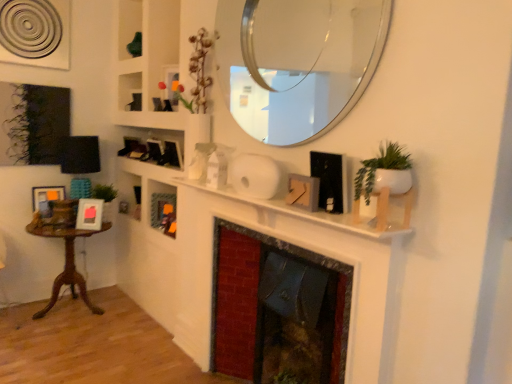
This screenshot has width=512, height=384. Describe the element at coordinates (384, 172) in the screenshot. I see `white matte plant pot at upper right` at that location.

Measure the distance between wooden frame at center and camera.

wooden frame at center and camera are 9.61 feet apart from each other.

This screenshot has width=512, height=384. What are the coordinates of `white matte fireplace at center` in the screenshot? It's located at (328, 213).

The image size is (512, 384). What do you see at coordinates (293, 254) in the screenshot?
I see `marble fireplace at center` at bounding box center [293, 254].

The height and width of the screenshot is (384, 512). Describe the element at coordinates (66, 262) in the screenshot. I see `wooden table at left` at that location.

Locate an element on the screen. The height and width of the screenshot is (384, 512). clear glass mirror at upper center is located at coordinates [x=306, y=64].

Who is bigger, matte white picture frame at left, the second picture frame when ordered from right to left, or matte gray picture frame at center, which is the 1th picture frame from right to left?

Bigger between the two is matte white picture frame at left, the second picture frame when ordered from right to left.

Considering the sizes of objects matte white picture frame at left, which is the second picture frame from back to front, and matte gray picture frame at center, which appears as the third picture frame when viewed from the left, in the image provided, who is shorter, matte white picture frame at left, which is the second picture frame from back to front, or matte gray picture frame at center, which appears as the third picture frame when viewed from the left,?

matte gray picture frame at center, which appears as the third picture frame when viewed from the left.

Is matte white picture frame at left, which is the second picture frame from back to front, aimed at matte gray picture frame at center, which is the 1th picture frame from right to left?

No, matte white picture frame at left, which is the second picture frame from back to front, is not facing towards matte gray picture frame at center, which is the 1th picture frame from right to left.

Based on the photo, can you confirm if white matte plant pot at upper right is bigger than matte wooden picture frame at left, which appears as the first picture frame when viewed from the back?

Correct, white matte plant pot at upper right is larger in size than matte wooden picture frame at left, which appears as the first picture frame when viewed from the back.

Based on the photo, is white matte plant pot at upper right aimed at matte wooden picture frame at left, which appears as the first picture frame when viewed from the back?

No, white matte plant pot at upper right is not turned towards matte wooden picture frame at left, which appears as the first picture frame when viewed from the back.

Who is shorter, white matte plant pot at upper right or matte wooden picture frame at left, marked as the 3th picture frame in a right-to-left arrangement?

matte wooden picture frame at left, marked as the 3th picture frame in a right-to-left arrangement, is shorter.

Is matte wooden picture frame at left, acting as the first picture frame starting from the left, located within white matte plant pot at upper right?

Definitely not — matte wooden picture frame at left, acting as the first picture frame starting from the left, is not inside white matte plant pot at upper right.

Is matte gray picture frame at center, the 3th picture frame positioned from the back, positioned in front of wooden table at left?

Yes.

Is matte gray picture frame at center, the 3th picture frame positioned from the back, situated inside wooden table at left or outside?

matte gray picture frame at center, the 3th picture frame positioned from the back, is not inside wooden table at left, it's outside.

Which point is more forward, (315, 177) or (76, 293)?

The point (315, 177) is closer.

Considering the relative positions of white matte plant pot at upper right and matte gray picture frame at center, the 3th picture frame positioned from the back, in the image provided, is white matte plant pot at upper right to the left of matte gray picture frame at center, the 3th picture frame positioned from the back, from the viewer's perspective?

Incorrect, white matte plant pot at upper right is not on the left side of matte gray picture frame at center, the 3th picture frame positioned from the back.

From the image's perspective, would you say white matte plant pot at upper right is positioned over matte gray picture frame at center, the 1th picture frame viewed from the front?

Correct, white matte plant pot at upper right appears higher than matte gray picture frame at center, the 1th picture frame viewed from the front, in the image.

Does white matte plant pot at upper right have a greater height compared to matte gray picture frame at center, which appears as the third picture frame when viewed from the left?

Yes.

From a real-world perspective, between white matte plant pot at upper right and matte gray picture frame at center, the 3th picture frame positioned from the back, who is vertically lower?

From a 3D spatial view, matte gray picture frame at center, the 3th picture frame positioned from the back, is below.

Does wooden table at left have a greater height compared to matte wooden picture frame at left, marked as the 3th picture frame in a right-to-left arrangement?

Yes, wooden table at left is taller than matte wooden picture frame at left, marked as the 3th picture frame in a right-to-left arrangement.

From a real-world perspective, does wooden table at left sit lower than matte wooden picture frame at left, acting as the first picture frame starting from the left?

Indeed, from a real-world perspective, wooden table at left is positioned beneath matte wooden picture frame at left, acting as the first picture frame starting from the left.

Between point (70, 262) and point (41, 197), which one is positioned behind?

The point (70, 262) is farther.

Looking at their sizes, would you say marble fireplace at center is wider or thinner than wooden frame at center?

In the image, marble fireplace at center appears to be wider than wooden frame at center.

Is marble fireplace at center inside or outside of wooden frame at center?

marble fireplace at center is not enclosed by wooden frame at center.

From a real-world perspective, is marble fireplace at center on wooden frame at center?

Incorrect, from a real-world perspective, marble fireplace at center is lower than wooden frame at center.

From the picture: Are marble fireplace at center and wooden frame at center far apart?

No.

Can we say clear glass mirror at upper center lies outside matte white picture frame at left, which is the second picture frame from back to front?

Yes.

Is clear glass mirror at upper center at the left side of matte white picture frame at left, arranged as the second picture frame when viewed from the front?

In fact, clear glass mirror at upper center is to the right of matte white picture frame at left, arranged as the second picture frame when viewed from the front.

Is clear glass mirror at upper center shorter than matte white picture frame at left, arranged as the second picture frame when viewed from the front?

Incorrect, the height of clear glass mirror at upper center does not fall short of that of matte white picture frame at left, arranged as the second picture frame when viewed from the front.

Considering the sizes of objects clear glass mirror at upper center and matte white picture frame at left, the second picture frame when ordered from right to left, in the image provided, who is wider, clear glass mirror at upper center or matte white picture frame at left, the second picture frame when ordered from right to left,?

matte white picture frame at left, the second picture frame when ordered from right to left.

You are a GUI agent. You are given a task and a screenshot of the screen. Output one action in this format:
    pyautogui.click(x=<x>, y=<y>)
    Task: Click on the picture frame that is the 1st object located behind the matte gray picture frame at center, which is the 1th picture frame from right to left
    This screenshot has height=384, width=512.
    Given the screenshot: What is the action you would take?
    pyautogui.click(x=89, y=214)

Locate an element on the screen. plant above the matte wooden picture frame at left, which appears as the first picture frame when viewed from the back (from a real-world perspective) is located at coordinates (384, 172).

Considering their positions, is matte gray picture frame at center, which is the 1th picture frame from right to left, positioned further to white matte plant pot at upper right than matte white picture frame at left, which is the second picture frame from back to front?

matte white picture frame at left, which is the second picture frame from back to front, lies further to white matte plant pot at upper right than the other object.

Based on their spatial positions, is clear glass mirror at upper center or matte gray picture frame at center, the 1th picture frame viewed from the front, closer to white matte plant pot at upper right?

Among the two, matte gray picture frame at center, the 1th picture frame viewed from the front, is located nearer to white matte plant pot at upper right.

From the picture: Estimate the real-world distances between objects in this image. Which object is closer to matte gray picture frame at center, which appears as the third picture frame when viewed from the left, matte white picture frame at left, arranged as the second picture frame when viewed from the front, or matte wooden picture frame at left, acting as the first picture frame starting from the left?

The object closer to matte gray picture frame at center, which appears as the third picture frame when viewed from the left, is matte white picture frame at left, arranged as the second picture frame when viewed from the front.

Based on their spatial positions, is matte gray picture frame at center, the 1th picture frame viewed from the front, or wooden table at left further from white matte plant pot at upper right?

Among the two, wooden table at left is located further to white matte plant pot at upper right.

When comparing their distances from matte white picture frame at left, which is the second picture frame from back to front, does marble fireplace at center or matte gray picture frame at center, the 1th picture frame viewed from the front, seem further?

Among the two, matte gray picture frame at center, the 1th picture frame viewed from the front, is located further to matte white picture frame at left, which is the second picture frame from back to front.

Estimate the real-world distances between objects in this image. Which object is further from marble fireplace at center, wooden frame at center or matte white picture frame at left, the second picture frame when ordered from right to left?

matte white picture frame at left, the second picture frame when ordered from right to left, is further to marble fireplace at center.

Estimate the real-world distances between objects in this image. Which object is closer to white matte fireplace at center, wooden frame at center or matte white picture frame at left, marked as the 2th picture frame in a left-to-right arrangement?

wooden frame at center is positioned closer to the anchor white matte fireplace at center.

Looking at the image, which one is located closer to wooden table at left, white matte fireplace at center or white matte plant pot at upper right?

white matte fireplace at center is closer to wooden table at left.

Where is `fireplace located between clear glass mirror at upper center and matte white picture frame at left, arranged as the second picture frame when viewed from the front, in the depth direction`? The image size is (512, 384). fireplace located between clear glass mirror at upper center and matte white picture frame at left, arranged as the second picture frame when viewed from the front, in the depth direction is located at coordinates (293, 254).

The image size is (512, 384). Find the location of `table between matte gray picture frame at center, the 1th picture frame viewed from the front, and wooden frame at center from front to back`. table between matte gray picture frame at center, the 1th picture frame viewed from the front, and wooden frame at center from front to back is located at coordinates (66, 262).

Where is `table between matte wooden picture frame at left, marked as the 3th picture frame in a right-to-left arrangement, and matte gray picture frame at center, the 1th picture frame viewed from the front, in the horizontal direction`? This screenshot has width=512, height=384. table between matte wooden picture frame at left, marked as the 3th picture frame in a right-to-left arrangement, and matte gray picture frame at center, the 1th picture frame viewed from the front, in the horizontal direction is located at coordinates (66, 262).

I want to click on picture frame between matte wooden picture frame at left, acting as the first picture frame starting from the left, and matte gray picture frame at center, which is the 1th picture frame from right to left, so pyautogui.click(x=89, y=214).